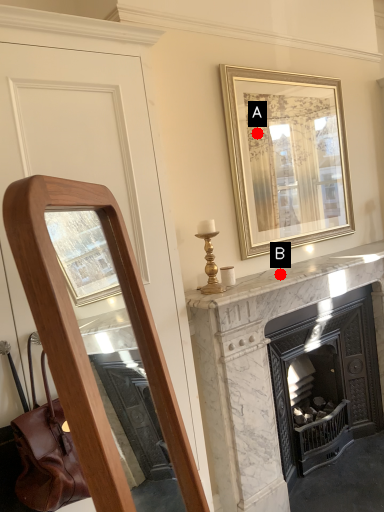
Question: Two points are circled on the image, labeled by A and B beside each circle. Which point is closer to the camera taking this photo?

Choices:
 (A) A is closer
 (B) B is closer

Answer: (B)